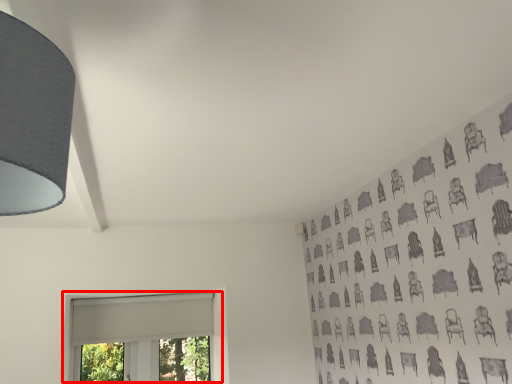
Question: From the image's perspective, what is the correct spatial positioning of window (annotated by the red box) in reference to lamp?

Choices:
 (A) below
 (B) above

Answer: (A)